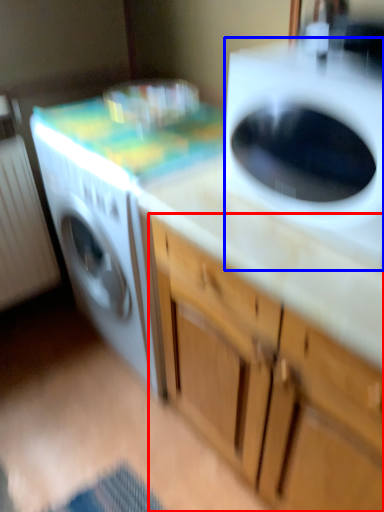
Question: Which of the following is the farthest to the observer, cabinetry (highlighted by a red box) or washing machine (highlighted by a blue box)?

Choices:
 (A) cabinetry
 (B) washing machine

Answer: (B)